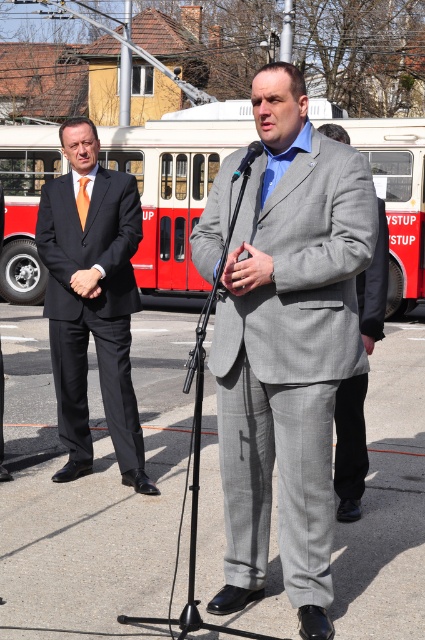
Question: Can you confirm if matte gray suit at center is thinner than black metallic microphone at center?

Choices:
 (A) yes
 (B) no

Answer: (B)

Question: Can you confirm if matte black suit at left is positioned below orange silk tie at center?

Choices:
 (A) no
 (B) yes

Answer: (B)

Question: Which of the following is the closest to the observer?

Choices:
 (A) gray textured suit at center
 (B) black metallic microphone at center
 (C) matte black hands at center

Answer: (A)

Question: Among these objects, which one is farthest from the camera?

Choices:
 (A) matte black suit at left
 (B) matte gray suit at center
 (C) gray wool suit at center

Answer: (A)

Question: Observing the image, what is the correct spatial positioning of matte black hands at center in reference to black metallic microphone at center?

Choices:
 (A) below
 (B) above

Answer: (A)

Question: Among these points, which one is farthest from the camera?

Choices:
 (A) (116, 273)
 (B) (96, 285)
 (C) (271, 257)
 (D) (252, 529)

Answer: (A)